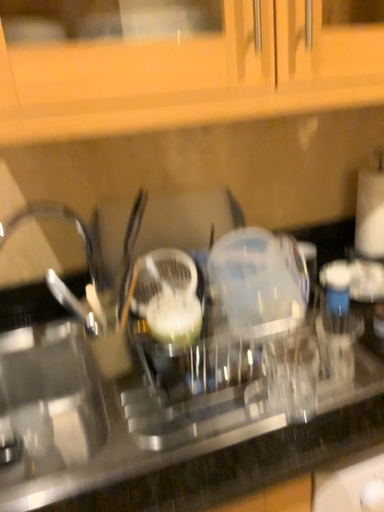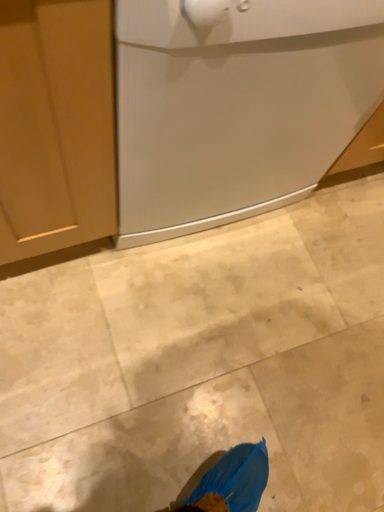
Question: How did the camera likely rotate when shooting the video?

Choices:
 (A) rotated left
 (B) rotated right

Answer: (B)